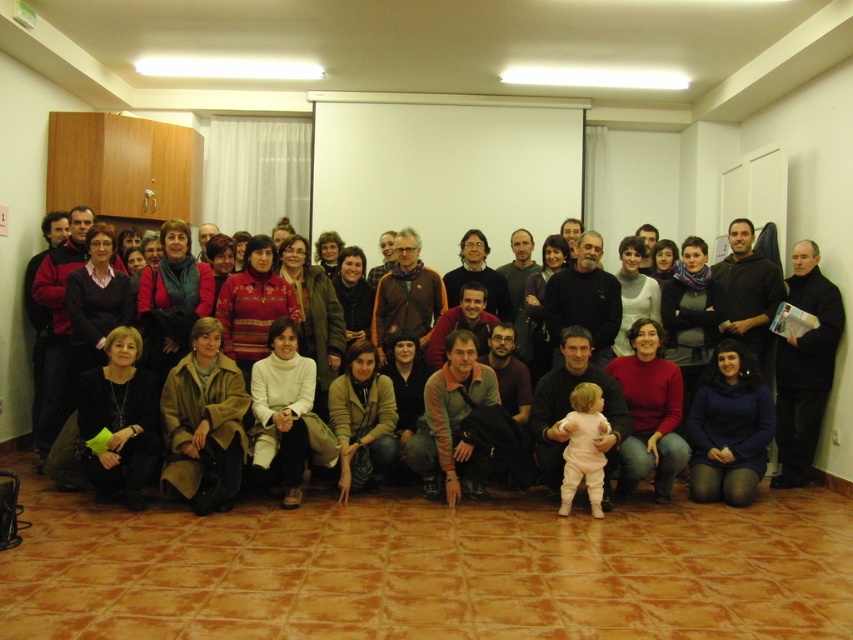
Does black matte jacket at right come behind matte black jacket at lower center?

Yes, it is behind matte black jacket at lower center.

Find the location of a particular element. The width and height of the screenshot is (853, 640). black matte jacket at right is located at coordinates (805, 365).